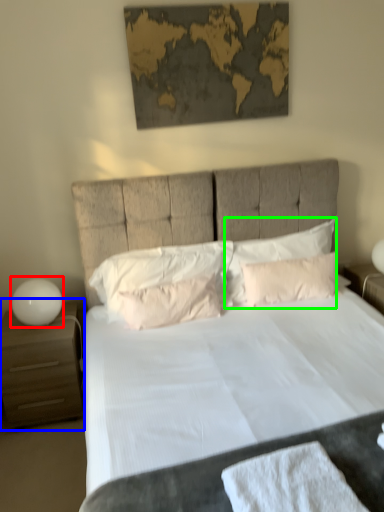
Question: Based on their relative distances, which object is nearer to table lamp (highlighted by a red box)? Choose from nightstand (highlighted by a blue box) and pillow (highlighted by a green box).

Choices:
 (A) nightstand
 (B) pillow

Answer: (A)